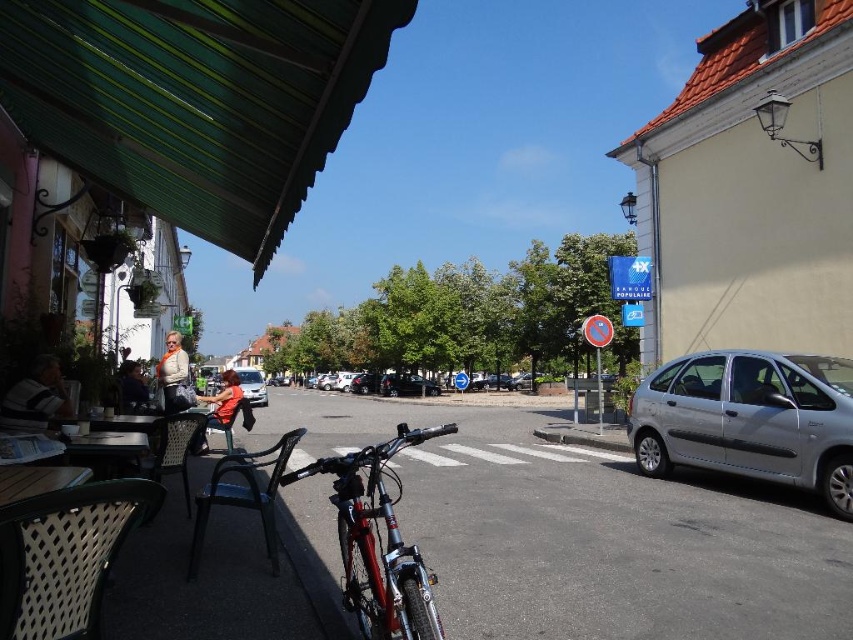
Question: Which of these objects is positioned closest to the green corrugated metal awning at upper left?

Choices:
 (A) shiny metallic bicycle at center
 (B) silver metallic car at center
 (C) silver metallic hatchback at right

Answer: (A)

Question: Does silver metallic hatchback at right have a greater width compared to matte black jacket at left?

Choices:
 (A) yes
 (B) no

Answer: (A)

Question: Which object appears closest to the camera in this image?

Choices:
 (A) silver metallic hatchback at right
 (B) matte black jacket at left
 (C) striped shirt at left

Answer: (C)

Question: Can you confirm if matte black jacket at left is smaller than silver metallic car at center?

Choices:
 (A) no
 (B) yes

Answer: (B)

Question: Which is farther from the orange fabric shirt at center?

Choices:
 (A) green corrugated metal awning at upper left
 (B) silver metallic car at center
 (C) matte black jacket at left

Answer: (A)

Question: Does shiny metallic bicycle at center lie behind silver metallic car at center?

Choices:
 (A) yes
 (B) no

Answer: (B)